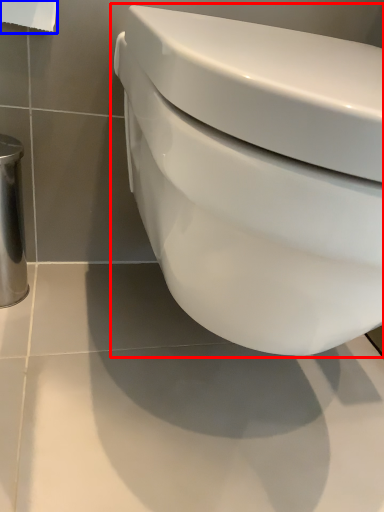
Question: Among these objects, which one is farthest to the camera, toilet (highlighted by a red box) or toilet paper (highlighted by a blue box)?

Choices:
 (A) toilet
 (B) toilet paper

Answer: (B)